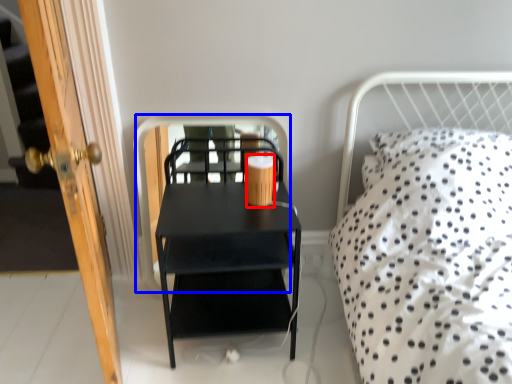
Question: Which point is further to the camera, coffee cup (highlighted by a red box) or screen door (highlighted by a blue box)?

Choices:
 (A) coffee cup
 (B) screen door

Answer: (B)